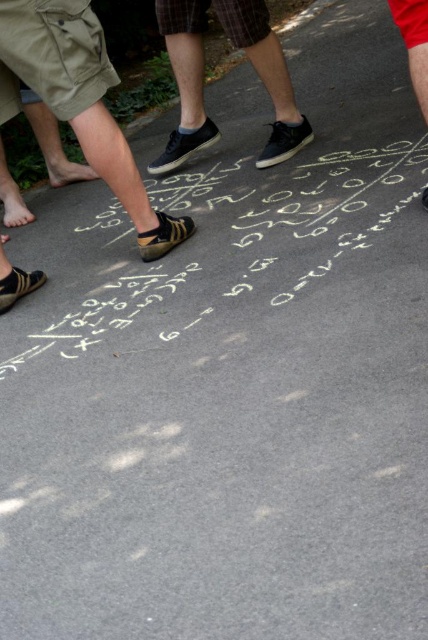
Does white chalk math equations at center have a lesser width compared to matte black shoes at center?

Incorrect, white chalk math equations at center's width is not less than matte black shoes at center's.

Is white chalk math equations at center closer to the viewer compared to matte black shoes at center?

Yes, it is.

Identify the location of white chalk math equations at center. This screenshot has width=428, height=640. (303, 205).

From the picture: Is leather shoe at center to the right of matte black shoes at center from the viewer's perspective?

Incorrect, leather shoe at center is not on the right side of matte black shoes at center.

Between point (30, 74) and point (262, 72), which one is positioned in front?

Point (30, 74)

Locate an element on the screen. The image size is (428, 640). leather shoe at center is located at coordinates (80, 100).

Is white chalk math equations at center further to camera compared to leather shoe at center?

That is False.

What do you see at coordinates (303, 205) in the screenshot?
I see `white chalk math equations at center` at bounding box center [303, 205].

Locate an element on the screen. This screenshot has width=428, height=640. white chalk math equations at center is located at coordinates (303, 205).